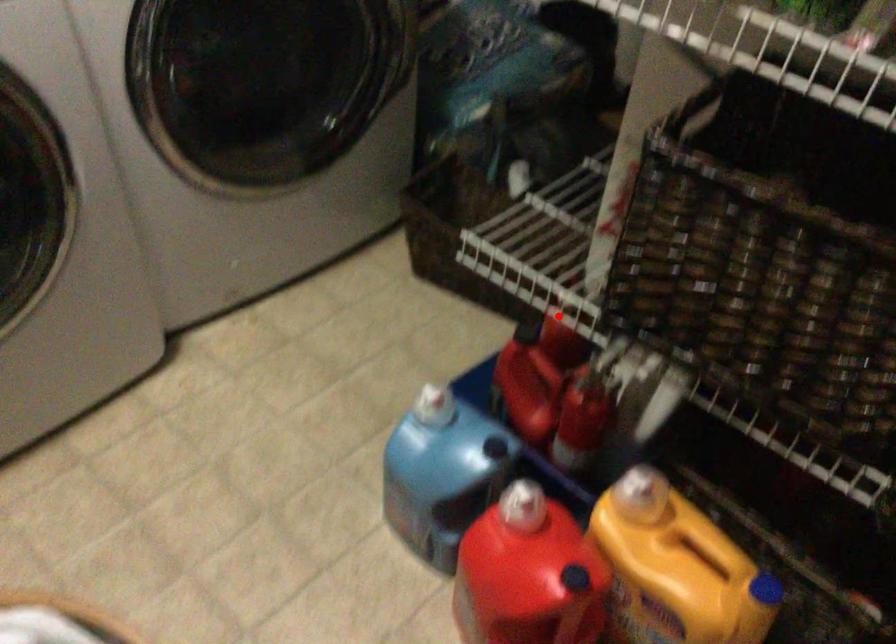
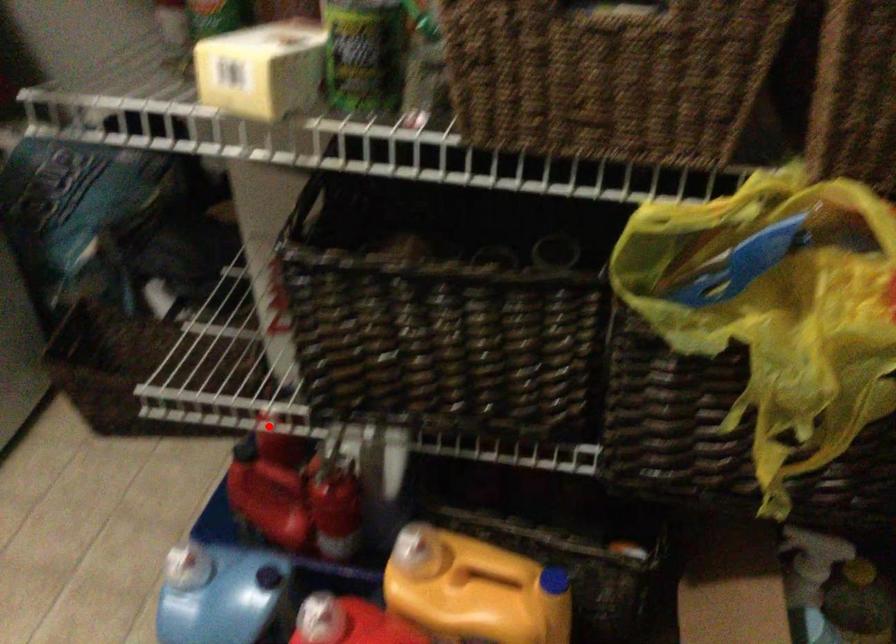
I am providing you with two images of the same scene from different viewpoints. A red point is marked on the first image and another point is marked on the second image. Do the highlighted points in image1 and image2 indicate the same real-world spot?

Yes